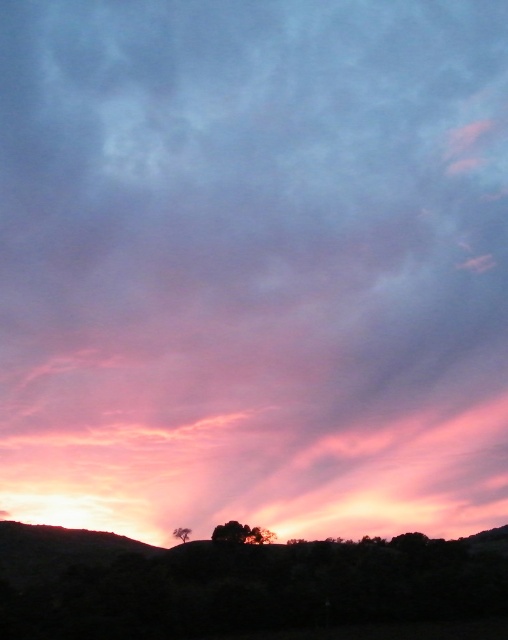
Question: Which point is farther from the camera taking this photo?

Choices:
 (A) (188, 532)
 (B) (236, 536)

Answer: (A)

Question: Is silhouetted tree at lower center wider than smooth brown tree at lower center?

Choices:
 (A) yes
 (B) no

Answer: (A)

Question: Estimate the real-world distances between objects in this image. Which object is closer to the dark brown textured hillside at lower center?

Choices:
 (A) silhouetted tree at lower center
 (B) smooth brown tree at lower center

Answer: (A)

Question: Does silhouetted tree at lower center lie behind smooth brown tree at lower center?

Choices:
 (A) yes
 (B) no

Answer: (B)

Question: Is dark brown textured hillside at lower center to the left of silhouetted tree at lower center from the viewer's perspective?

Choices:
 (A) yes
 (B) no

Answer: (A)

Question: Which point is closer to the camera?

Choices:
 (A) (45, 582)
 (B) (175, 536)

Answer: (A)